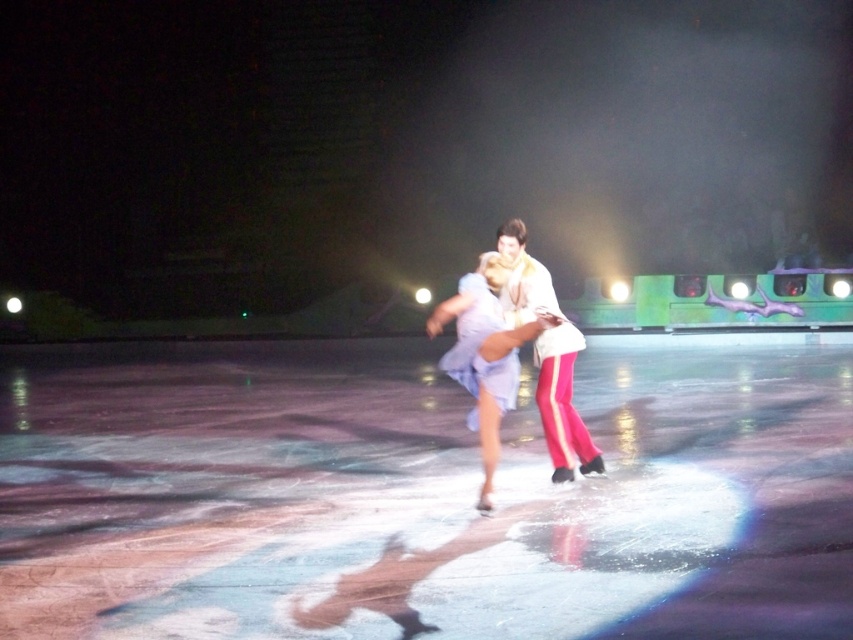
Question: Where is glossy ice skating rink at center located in relation to light blue fabric dress at center in the image?

Choices:
 (A) below
 (B) above

Answer: (A)

Question: Is glossy ice skating rink at center in front of light blue fabric dress at center?

Choices:
 (A) yes
 (B) no

Answer: (A)

Question: Which point is closer to the camera?

Choices:
 (A) light blue fabric dress at center
 (B) glossy ice skating rink at center

Answer: (B)

Question: Which object is farther from the camera taking this photo?

Choices:
 (A) glossy ice skating rink at center
 (B) light blue fabric dress at center

Answer: (B)

Question: Which point is closer to the camera?

Choices:
 (A) (281, 502)
 (B) (527, 310)

Answer: (A)

Question: Does glossy ice skating rink at center have a greater width compared to light blue fabric dress at center?

Choices:
 (A) yes
 (B) no

Answer: (A)